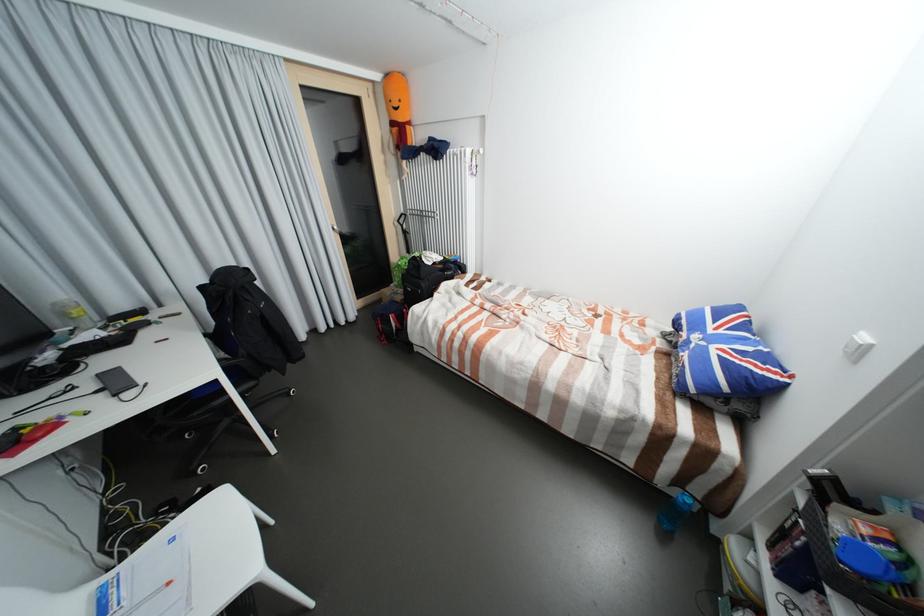
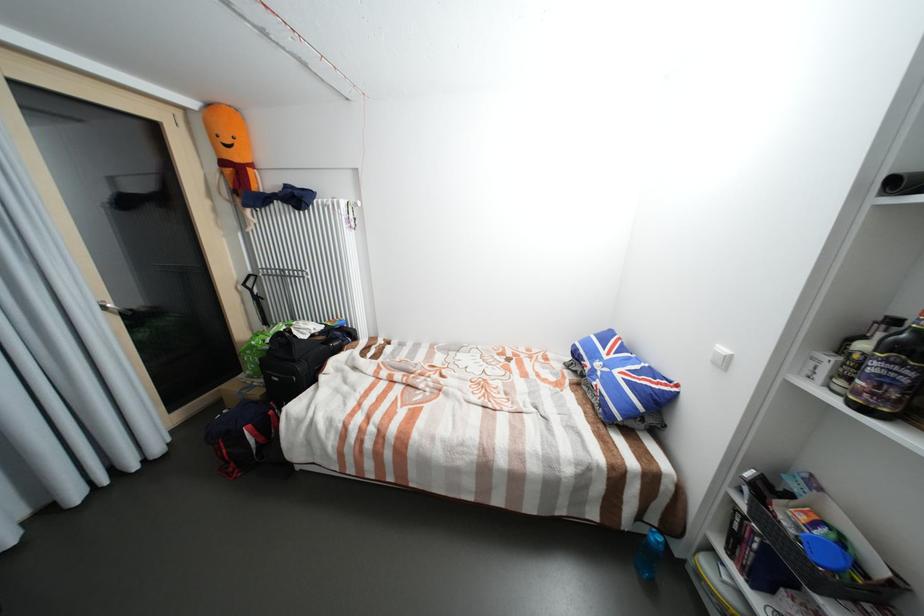
Where in the second image is the point corresponding to pixel 718 331 from the first image?

(613, 358)